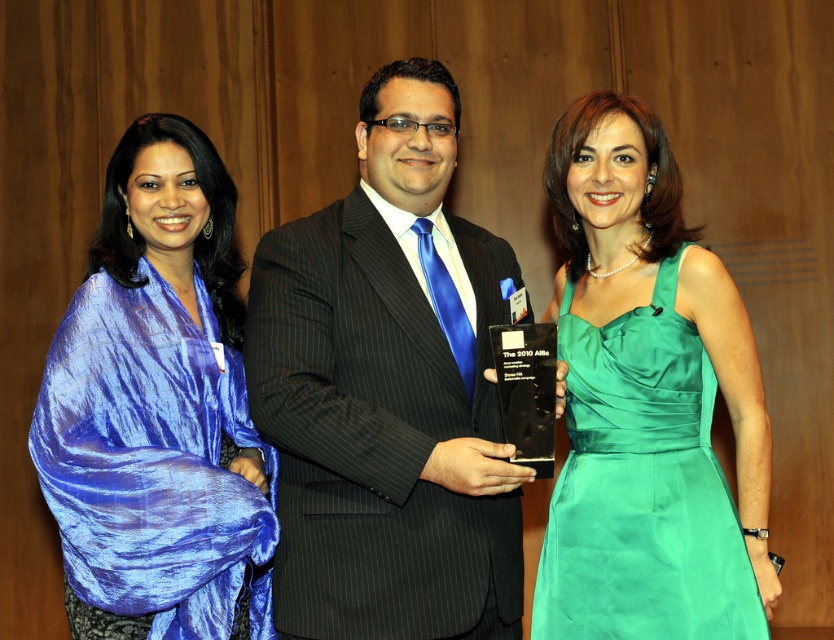
You are standing in the room and want to take a photo of the matte black suit at center. Where should you position yourself to capture it in the frame?

Position yourself so that the camera is aimed at the coordinates point [388,390] to capture the matte black suit at center in the frame.

You are a photographer at the event and need to adjust the lighting to ensure both the matte black suit at center and the blue silk scarf at left are well lit. Which object is closer to the camera based on their positions?

The matte black suit at center is positioned over the blue silk scarf at left, meaning it is closer to the camera.